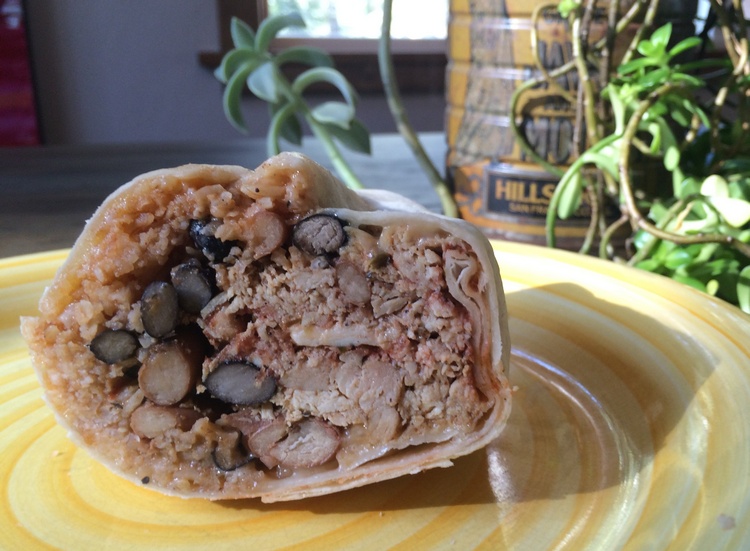
Image resolution: width=750 pixels, height=551 pixels. I want to click on purple wall, so click(114, 96).